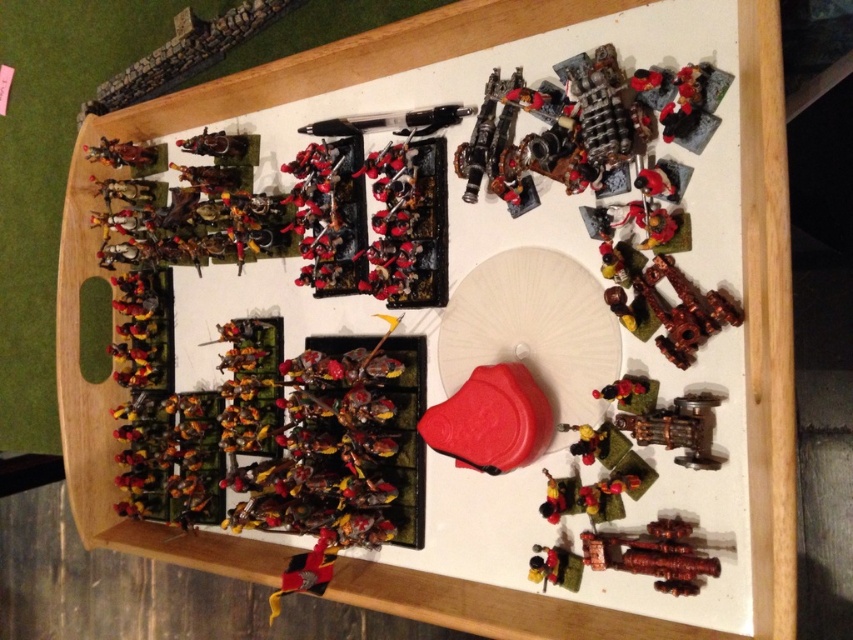
Which is above, white paper plate at center or shiny gold armor at upper left?

shiny gold armor at upper left

Does white paper plate at center appear under shiny gold armor at upper left?

Yes, white paper plate at center is below shiny gold armor at upper left.

What do you see at coordinates (532, 328) in the screenshot? I see `white paper plate at center` at bounding box center [532, 328].

Where is `white paper plate at center`? white paper plate at center is located at coordinates (532, 328).